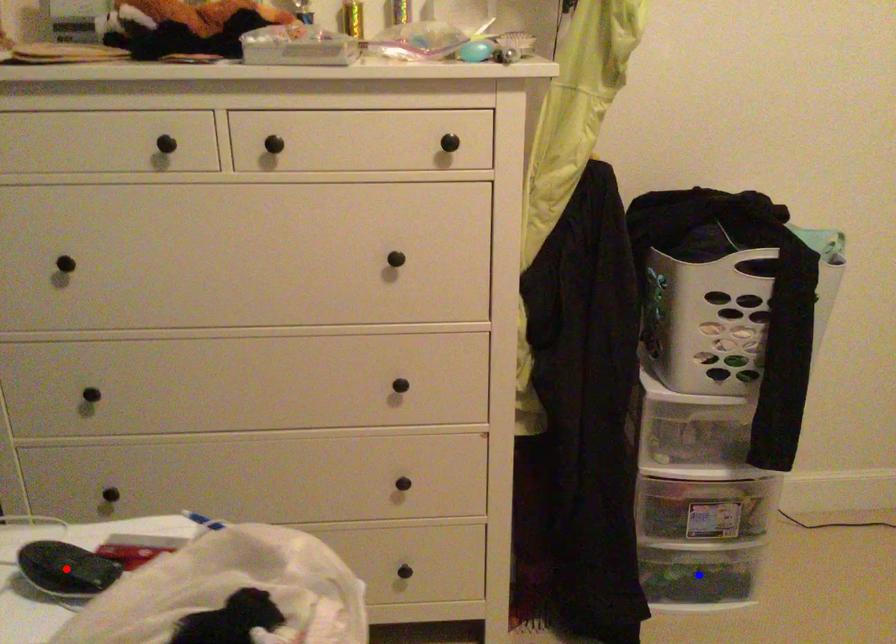
Question: Which of the two points in the image is closer to the camera?

Choices:
 (A) Blue point is closer.
 (B) Red point is closer.

Answer: (B)